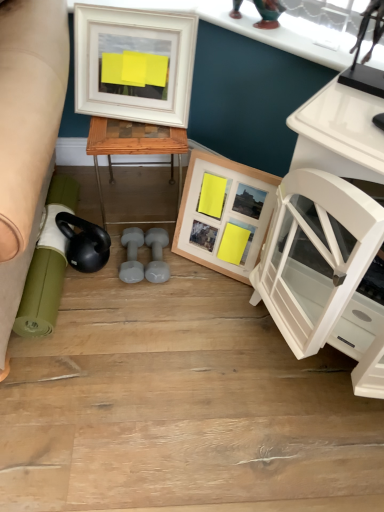
Question: Is white glossy cabinet at right taller or shorter than wooden picture frame at center, which ranks as the first picture frame in bottom-to-top order?

Choices:
 (A) tall
 (B) short

Answer: (A)

Question: Is point (350, 204) positioned closer to the camera than point (200, 230)?

Choices:
 (A) closer
 (B) farther

Answer: (A)

Question: Estimate the real-world distances between objects in this image. Which object is farther from the gray rubber dumbbell at center, the 1th dumbbell from the right?

Choices:
 (A) white matte picture frame at upper left, which is the second picture frame from bottom to top
 (B) wooden picture frame at center, marked as the 1th picture frame in a right-to-left arrangement
 (C) woodenobject at center
 (D) green rubber mat at lower left
 (E) white glossy cabinet at right

Answer: (E)

Question: Which is farther from the wooden picture frame at center, which is the 2th picture frame from left to right?

Choices:
 (A) gray rubber dumbbell at center, acting as the 2th dumbbell starting from the left
 (B) white matte picture frame at upper left, which is the second picture frame from bottom to top
 (C) white glossy cabinet at right
 (D) green rubber mat at lower left
 (E) woodenobject at center

Answer: (D)